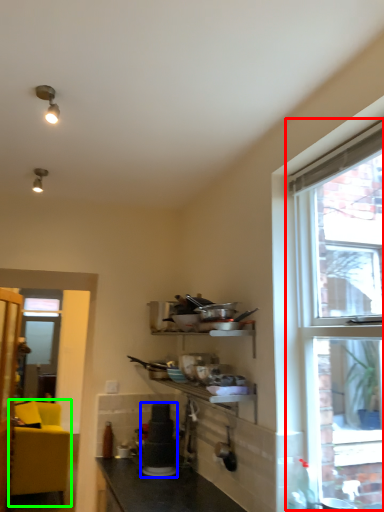
Question: Estimate the real-world distances between objects in this image. Which object is farther from window (highlighted by a red box), appliance (highlighted by a blue box) or studio couch (highlighted by a green box)?

Choices:
 (A) appliance
 (B) studio couch

Answer: (B)